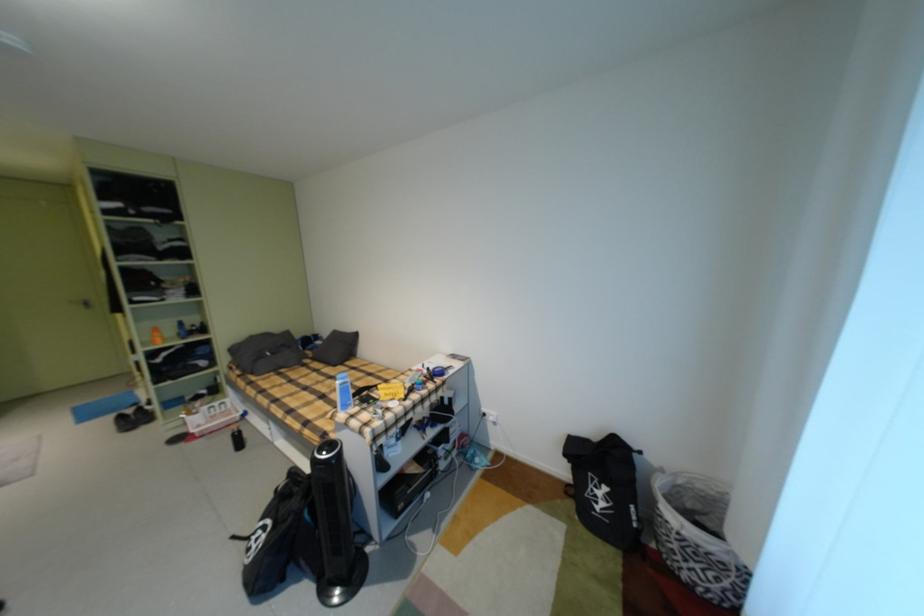
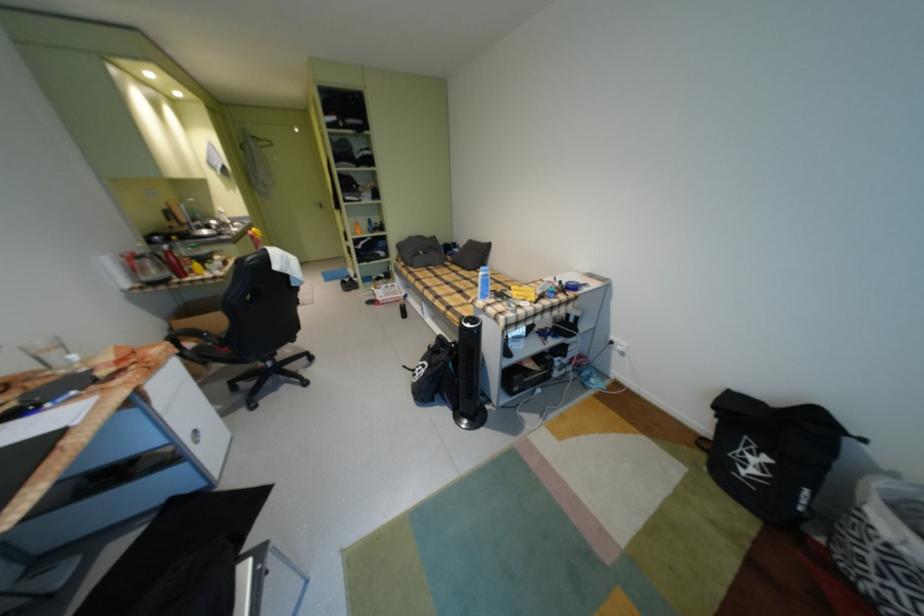
Where in the second image is the point corresponding to point (345, 368) from the first image?

(479, 272)